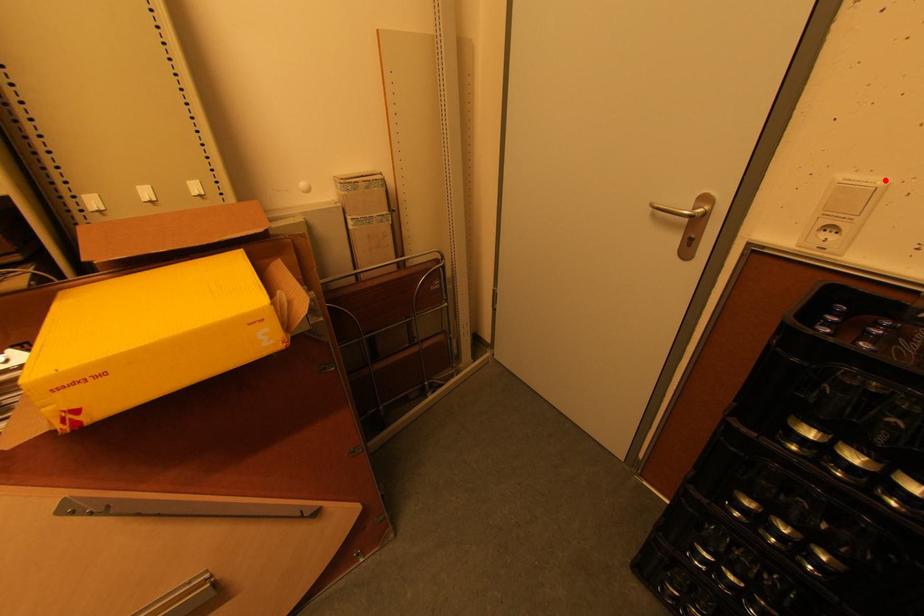
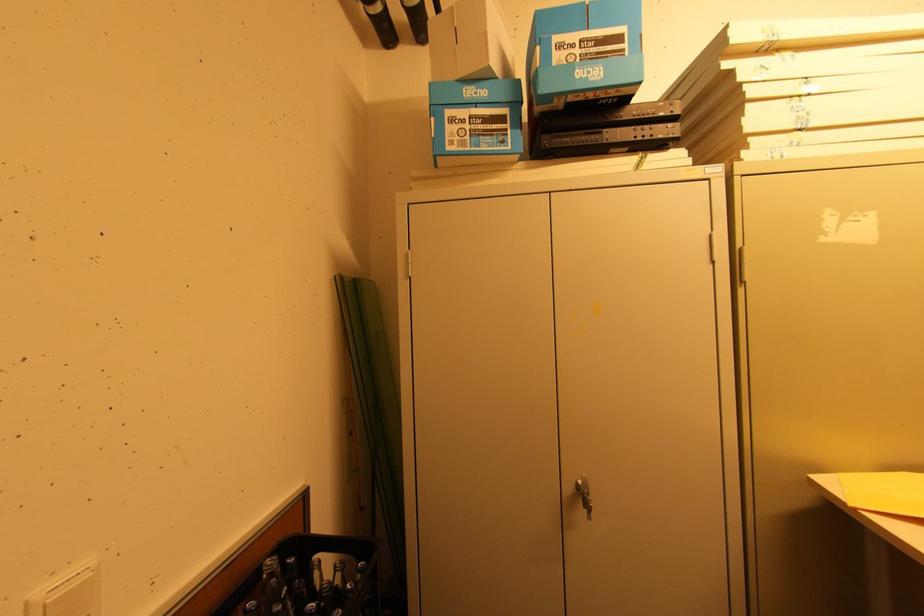
Find the pixel in the second image that matches the highlighted location in the first image.

(91, 562)